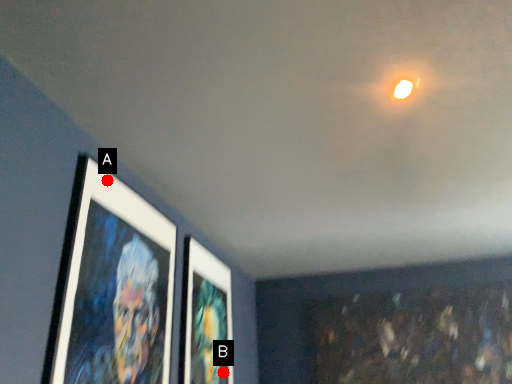
Question: Two points are circled on the image, labeled by A and B beside each circle. Which point is further to the camera?

Choices:
 (A) A is further
 (B) B is further

Answer: (B)